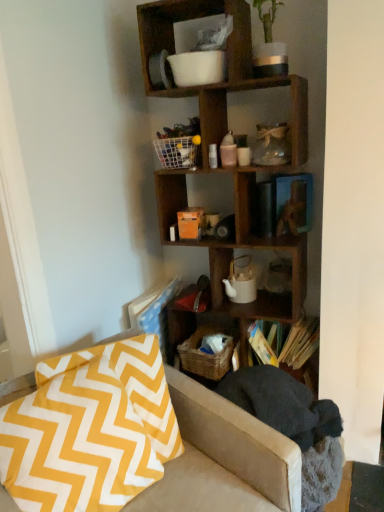
Question: From a real-world perspective, is hardcover books at center on top of white mesh basket at upper center?

Choices:
 (A) yes
 (B) no

Answer: (B)

Question: Does hardcover books at center have a larger size compared to white mesh basket at upper center?

Choices:
 (A) yes
 (B) no

Answer: (A)

Question: Is hardcover books at center shorter than white mesh basket at upper center?

Choices:
 (A) yes
 (B) no

Answer: (B)

Question: Considering the relative positions of hardcover books at center and white mesh basket at upper center in the image provided, is hardcover books at center to the right of white mesh basket at upper center from the viewer's perspective?

Choices:
 (A) no
 (B) yes

Answer: (B)

Question: Is hardcover books at center to the left of white mesh basket at upper center from the viewer's perspective?

Choices:
 (A) yes
 (B) no

Answer: (B)

Question: From a real-world perspective, is hardcover books at center located beneath white mesh basket at upper center?

Choices:
 (A) yes
 (B) no

Answer: (A)

Question: Can you confirm if white mesh basket at upper center is bigger than woven brown basket at lower center?

Choices:
 (A) no
 (B) yes

Answer: (A)

Question: Is white mesh basket at upper center shorter than woven brown basket at lower center?

Choices:
 (A) no
 (B) yes

Answer: (B)

Question: From a real-world perspective, is white mesh basket at upper center under woven brown basket at lower center?

Choices:
 (A) yes
 (B) no

Answer: (B)

Question: Considering the relative positions of white mesh basket at upper center and woven brown basket at lower center in the image provided, is white mesh basket at upper center in front of woven brown basket at lower center?

Choices:
 (A) yes
 (B) no

Answer: (A)

Question: Is white mesh basket at upper center further to the viewer compared to woven brown basket at lower center?

Choices:
 (A) yes
 (B) no

Answer: (B)

Question: Can you confirm if white mesh basket at upper center is thinner than woven brown basket at lower center?

Choices:
 (A) yes
 (B) no

Answer: (A)

Question: Is white mesh basket at upper center placed right next to yellow and white zigzag fabric at lower left?

Choices:
 (A) yes
 (B) no

Answer: (B)